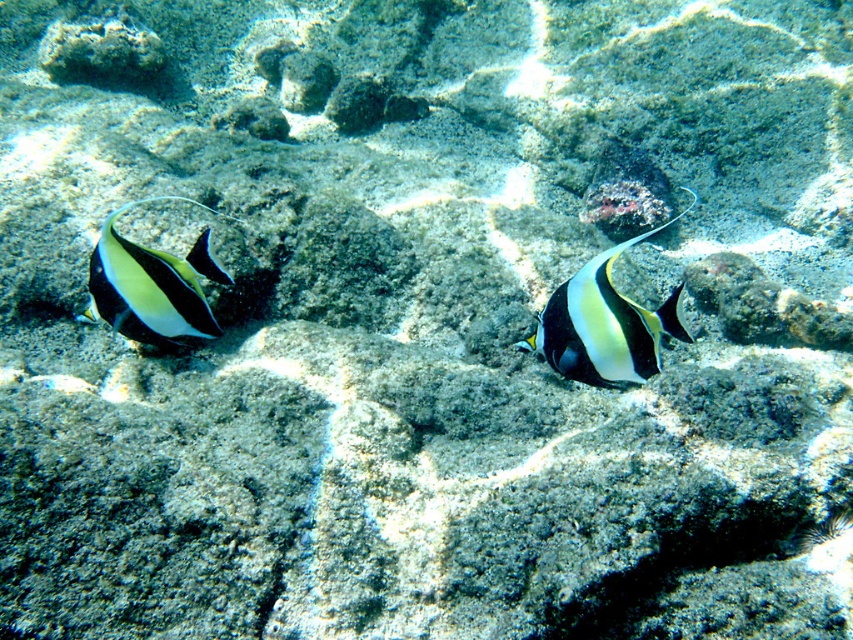
Question: Is black glossy fish at center positioned behind shiny silver fish at left?

Choices:
 (A) no
 (B) yes

Answer: (A)

Question: Does black glossy fish at center appear over shiny silver fish at left?

Choices:
 (A) no
 (B) yes

Answer: (A)

Question: Which object appears farthest from the camera in this image?

Choices:
 (A) black glossy fish at center
 (B) shiny silver fish at left

Answer: (B)

Question: Which point is farther from the camera taking this photo?

Choices:
 (A) (141, 337)
 (B) (569, 371)

Answer: (A)

Question: Does black glossy fish at center have a smaller size compared to shiny silver fish at left?

Choices:
 (A) no
 (B) yes

Answer: (B)